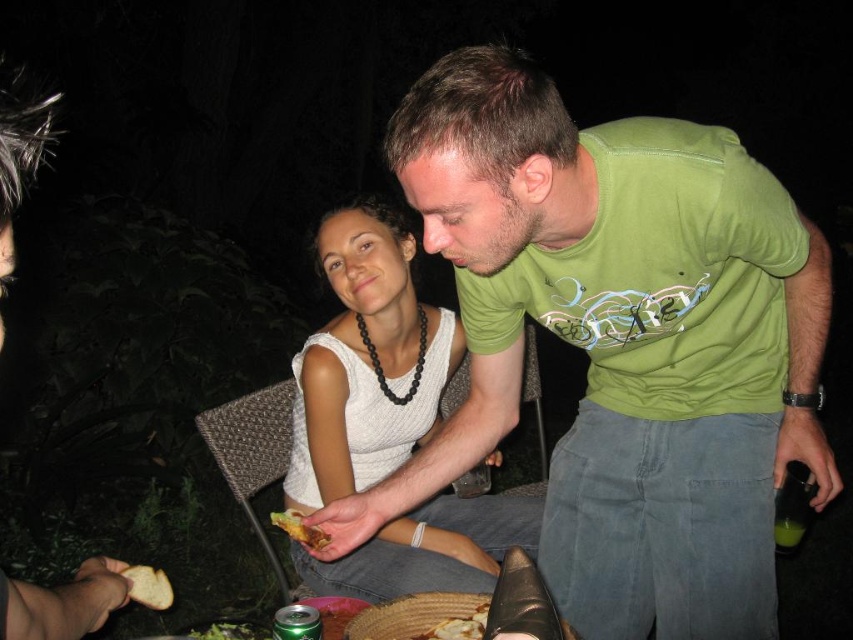
Question: Does green cotton shirt at center have a smaller size compared to white matte tank top at center?

Choices:
 (A) no
 (B) yes

Answer: (A)

Question: Does white matte tank top at center appear over golden crispy bread at lower left?

Choices:
 (A) yes
 (B) no

Answer: (A)

Question: Which point appears closest to the camera in this image?

Choices:
 (A) (200, 636)
 (B) (138, 593)
 (C) (305, 538)

Answer: (B)

Question: Where is white matte tank top at center located in relation to white matte bread at lower left in the image?

Choices:
 (A) below
 (B) above

Answer: (B)

Question: Estimate the real-world distances between objects in this image. Which object is closer to the golden crispy bread at lower center?

Choices:
 (A) white matte tank top at center
 (B) green cotton shirt at center

Answer: (B)

Question: Which point appears farthest from the camera in this image?

Choices:
 (A) (219, 637)
 (B) (433, 627)
 (C) (277, 513)

Answer: (C)